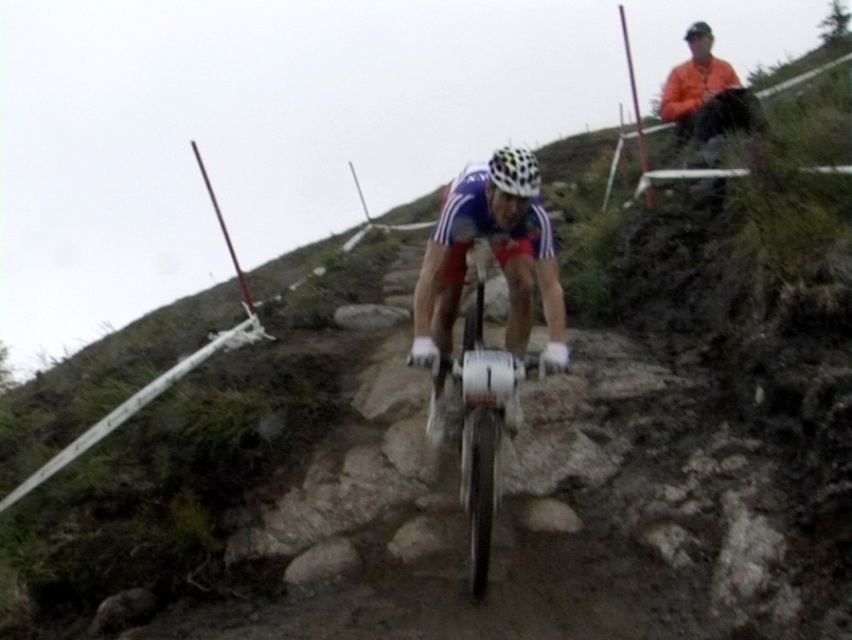
You are a photographer at the mountain biking event. You want to capture a photo where both the shiny metallic bicycle at center and the multicolored matte bicycle helmet at center are clearly visible. Considering their sizes, which object should you focus on to ensure both are in frame without cropping?

The shiny metallic bicycle at center is larger than the multicolored matte bicycle helmet at center, so focusing on the bicycle will ensure both are in frame without cropping.

You are a photographer positioned at the starting line of the mountain biking event. You want to capture a photo that includes both the shiny metallic bicycle at center and the multicolored matte bicycle helmet at center. Based on their positions, which object should you adjust your camera focus to first to ensure both are in frame?

The shiny metallic bicycle at center is to the left of the multicolored matte bicycle helmet at center, so you should adjust your camera focus to the shiny metallic bicycle at center first to ensure both are in frame.

You are a photographer trying to capture the cyclist and their gear in the scene. You need to ensure both the shiny metallic bicycle at center and the multicolored matte bicycle helmet at center are fully visible in your shot. Which object requires a wider angle to capture its full width in the photo?

The shiny metallic bicycle at center requires a wider angle to capture its full width because its width surpasses that of the multicolored matte bicycle helmet at center.